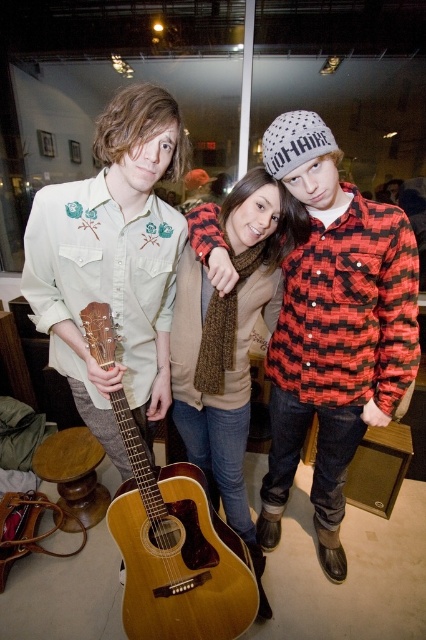
Which is behind, point (141, 100) or point (183, 280)?

The point (183, 280) is behind.

Does matte light green shirt at center come in front of brown knitted scarf at center?

Yes, it is in front of brown knitted scarf at center.

What do you see at coordinates (112, 262) in the screenshot?
I see `matte light green shirt at center` at bounding box center [112, 262].

At what (x,y) coordinates should I click in order to perform the action: click on matte light green shirt at center. Please return your answer as a coordinate pair (x, y). Looking at the image, I should click on (112, 262).

Does red plaid shirt at center come in front of brown knitted scarf at center?

Yes, it is in front of brown knitted scarf at center.

What do you see at coordinates (333, 326) in the screenshot? This screenshot has width=426, height=640. I see `red plaid shirt at center` at bounding box center [333, 326].

Identify the location of red plaid shirt at center. (333, 326).

Is point (281, 154) less distant than point (204, 540)?

Yes, it is.

What are the coordinates of `red plaid shirt at center` in the screenshot? It's located at (333, 326).